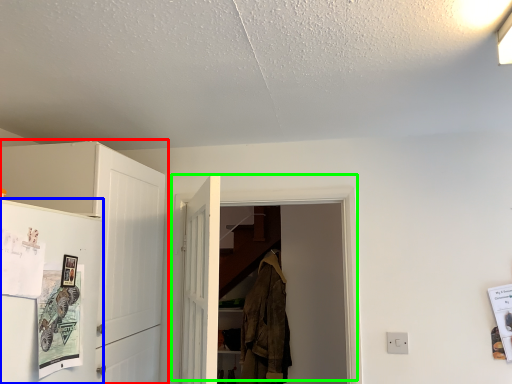
Question: Which object is the closest to the cabinetry (highlighted by a red box)? Choose among these: fridge (highlighted by a blue box) or door (highlighted by a green box).

Choices:
 (A) fridge
 (B) door

Answer: (A)